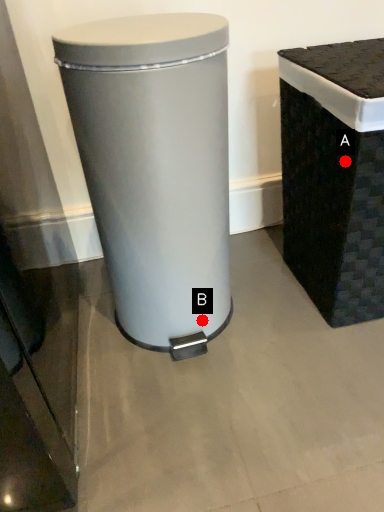
Question: Two points are circled on the image, labeled by A and B beside each circle. Which point is further to the camera?

Choices:
 (A) A is further
 (B) B is further

Answer: (B)